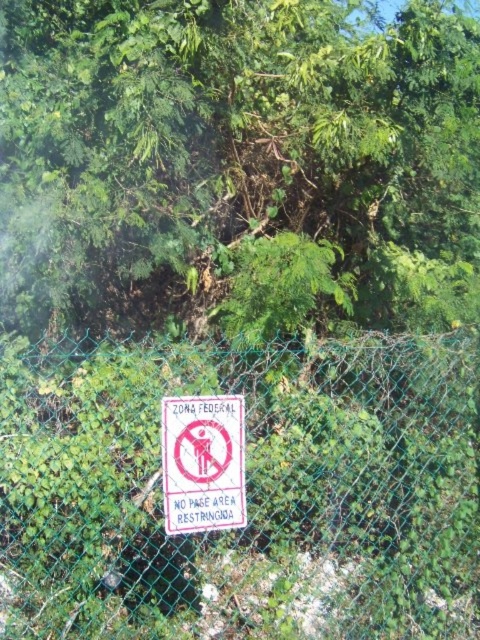
You are a hiker who wants to take a shortcut through the green mesh fence at center. You see the green leafy tree at center nearby. Which object is closer to your current position?

The green leafy tree at center is positioned on the right side of green mesh fence at center, so the green mesh fence at center is closer to your current position.

You are a park ranger who needs to determine if the green leafy tree at center is blocking the white paper sign at center from view. Based on the scene description, can you confirm if the tree is larger than the sign?

The green leafy tree at center has a larger size compared to the white paper sign at center, so yes, the tree is larger than the sign and may be blocking it from view.

You are standing at the origin point of the coordinate system. Where is the green mesh fence at center located?

The green mesh fence at center is located at point (240, 490).